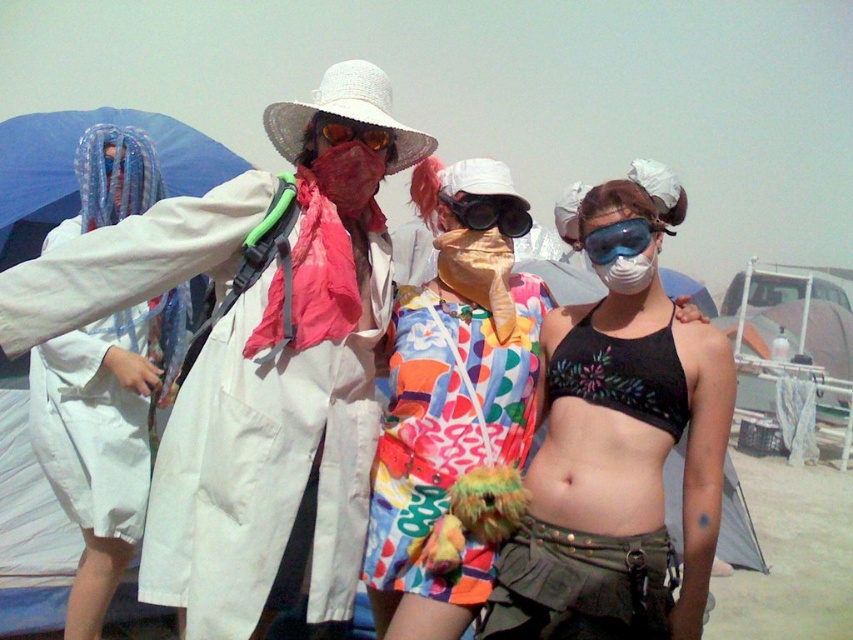
Question: Among these objects, which one is nearest to the camera?

Choices:
 (A) transparent plastic goggles at center
 (B) black embroidered bikini top at lower right
 (C) shiny orange goggles at center
 (D) white cotton coat at center

Answer: (D)

Question: Estimate the real-world distances between objects in this image. Which object is closer to the black embroidered bikini top at lower right?

Choices:
 (A) shiny orange goggles at center
 (B) black plastic goggles at center
 (C) transparent plastic goggles at center

Answer: (C)

Question: Can you confirm if black embroidered bikini top at lower right is wider than transparent plastic goggles at center?

Choices:
 (A) no
 (B) yes

Answer: (B)

Question: Can you confirm if floral fabric dress at center is positioned to the left of transparent plastic goggles at center?

Choices:
 (A) yes
 (B) no

Answer: (A)

Question: Is black embroidered bikini top at lower right positioned before black plastic goggles at center?

Choices:
 (A) no
 (B) yes

Answer: (B)

Question: Which of the following is the farthest from the observer?

Choices:
 (A) shiny orange goggles at center
 (B) white cotton coat at center
 (C) transparent plastic goggles at center
 (D) black embroidered bikini top at lower right

Answer: (A)